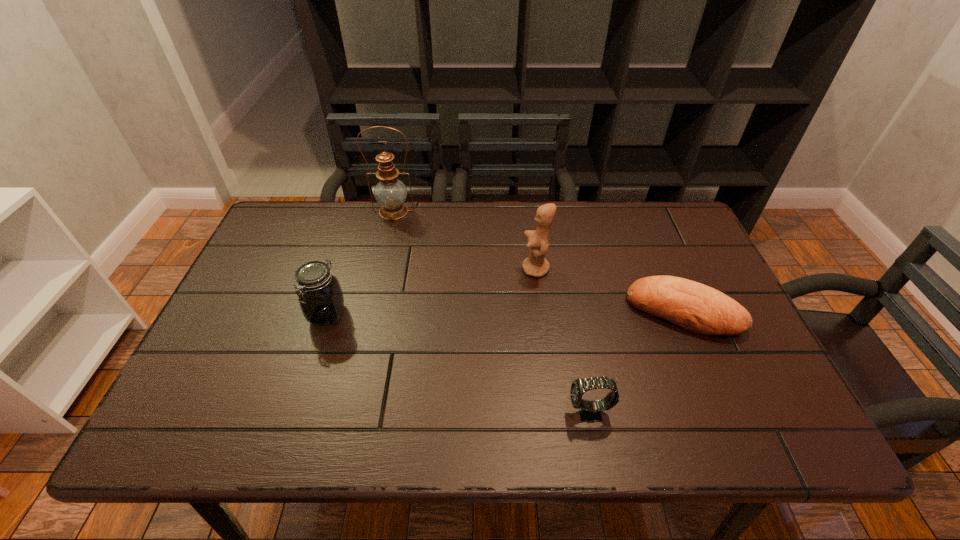
Identify the location of the farthest object. This screenshot has height=540, width=960. (390, 193).

In order to click on oil lamp in this screenshot , I will do `click(390, 193)`.

The height and width of the screenshot is (540, 960). I want to click on the fourth nearest object, so pyautogui.click(x=536, y=265).

The height and width of the screenshot is (540, 960). I want to click on the second tallest object, so click(536, 265).

Identify the location of the third tallest object. (321, 299).

Find the location of a particular element. the nearest object is located at coordinates (590, 411).

Locate an element on the screen. This screenshot has height=540, width=960. watch is located at coordinates (590, 411).

The image size is (960, 540). What are the coordinates of `bread` in the screenshot? It's located at (693, 306).

This screenshot has height=540, width=960. Identify the location of the shortest object. (693, 306).

Locate an element on the screen. free space located on the right of the oil lamp is located at coordinates (435, 211).